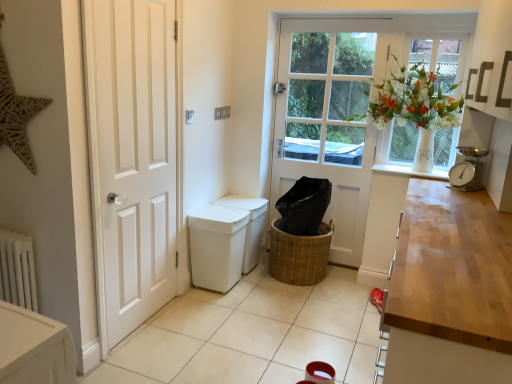
Question: From the image's perspective, relative to white glass window at upper right, is white wooden door at center, marked as the second door in a left-to-right arrangement, above or below?

Choices:
 (A) below
 (B) above

Answer: (A)

Question: In the image, is white wooden door at center, marked as the second door in a left-to-right arrangement, on the left side or the right side of white glass window at upper right?

Choices:
 (A) right
 (B) left

Answer: (B)

Question: Which object is the farthest from the white wooden door at center, marked as the first door in a right-to-left arrangement?

Choices:
 (A) silver metallic scale at right
 (B) white plastic bin at lower center
 (C) white glossy door at left, which is counted as the first door, starting from the front
 (D) woven brown basket at center
 (E) white matte radiator at lower left

Answer: (E)

Question: Which object is positioned closest to the woven brown basket at center?

Choices:
 (A) white tile at center
 (B) white wooden door at center, the second door viewed from the front
 (C) white glass window at upper right
 (D) white plastic bin at lower center
 (E) white glossy door at left, which is counted as the first door, starting from the front

Answer: (D)